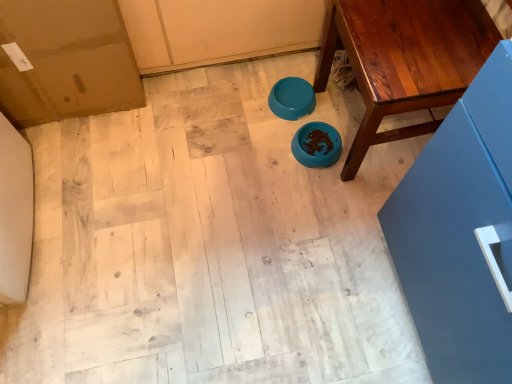
The image size is (512, 384). In order to click on free space in front of wooden table at center in this screenshot , I will do `click(335, 226)`.